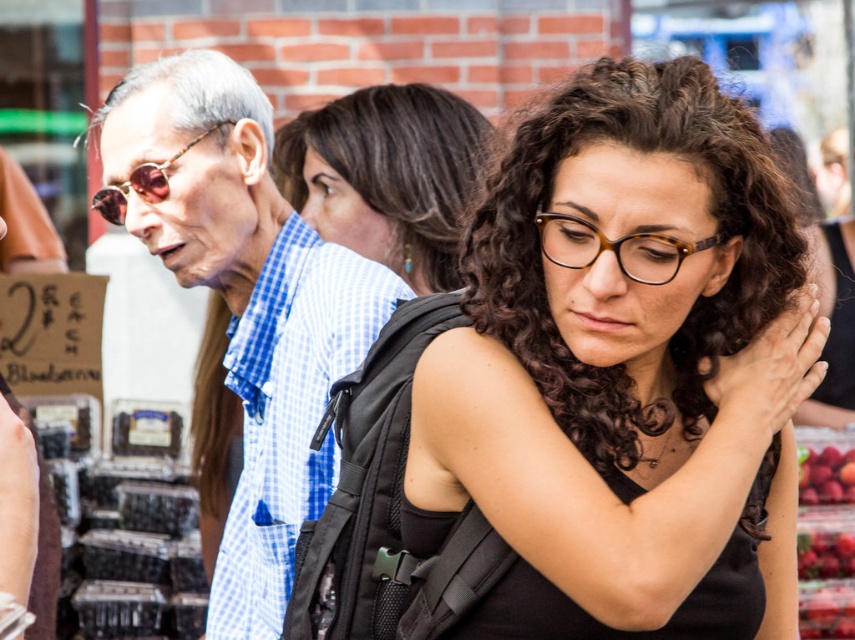
In the scene shown: Is the position of black matte vest at center more distant than that of shiny red strawberries at right?

No, it is not.

Does point (593, 396) lie behind point (805, 528)?

No, (593, 396) is closer to viewer.

At what (x,y) coordinates should I click in order to perform the action: click on black matte vest at center. Please return your answer as a coordinate pair (x, y). Looking at the image, I should click on tap(624, 369).

Does black matte vest at center have a greater width compared to sunglassesmetallicglasses at left?

Yes.

Is black matte vest at center below sunglassesmetallicglasses at left?

Yes, black matte vest at center is below sunglassesmetallicglasses at left.

Measure the distance between black matte vest at center and camera.

black matte vest at center and camera are 12.34 feet apart.

This screenshot has height=640, width=855. In order to click on black matte vest at center in this screenshot , I will do `click(624, 369)`.

Is point (818, 582) behind point (564, 256)?

Yes, it is behind point (564, 256).

What do you see at coordinates (826, 532) in the screenshot? This screenshot has height=640, width=855. I see `shiny red strawberries at right` at bounding box center [826, 532].

Locate an element on the screen. This screenshot has width=855, height=640. shiny red strawberries at right is located at coordinates (826, 532).